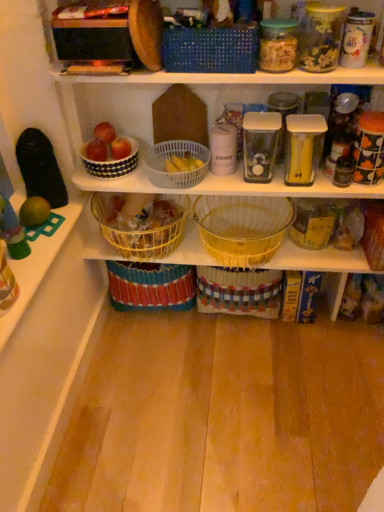
Describe the element at coordinates (374, 234) in the screenshot. The width and height of the screenshot is (384, 512). I see `woven straw basket at lower right, which is the 1th basket from right to left` at that location.

Measure the distance between point (193, 155) and camera.

They are 4.71 feet apart.

The image size is (384, 512). I want to click on woven yellow basket at center, which ranks as the 2th basket in right-to-left order, so click(x=242, y=227).

What do you see at coordinates (278, 45) in the screenshot? This screenshot has height=512, width=384. I see `translucent plastic jar at upper center, positioned as the 4th glass jar in right-to-left order` at bounding box center [278, 45].

This screenshot has width=384, height=512. Find the location of `blue woven basket at upper center, the third basket in the right-to-left sequence`. blue woven basket at upper center, the third basket in the right-to-left sequence is located at coordinates (210, 50).

From the picture: From the image's perspective, which is above, black glass jar at right or yellow woven basket at center, which appears as the 1th basket when viewed from the left?

black glass jar at right, from the image's perspective.

Is point (350, 166) positioned in front of point (128, 253)?

Yes, point (350, 166) is in front of point (128, 253).

Is yellow woven basket at center, which appears as the 1th basket when viewed from the left, completely or partially inside black glass jar at right?

No, yellow woven basket at center, which appears as the 1th basket when viewed from the left, is not a part of black glass jar at right.

Is black glass jar at right oriented away from yellow woven basket at center, which appears as the 1th basket when viewed from the left?

No, yellow woven basket at center, which appears as the 1th basket when viewed from the left, is not at the back of black glass jar at right.

Which is more to the left, clear plastic container at center, the third glass jar positioned from the left, or shiny red apple at upper center, positioned as the second apple in left-to-right order?

Positioned to the left is shiny red apple at upper center, positioned as the second apple in left-to-right order.

From their relative heights in the image, would you say clear plastic container at center, arranged as the third glass jar when viewed from the right, is taller or shorter than shiny red apple at upper center, positioned as the second apple in left-to-right order?

Considering their sizes, clear plastic container at center, arranged as the third glass jar when viewed from the right, has more height than shiny red apple at upper center, positioned as the second apple in left-to-right order.

Between clear plastic container at center, the third glass jar positioned from the left, and shiny red apple at upper center, marked as the 1th apple in a right-to-left arrangement, which one has larger width?

Wider between the two is clear plastic container at center, the third glass jar positioned from the left.

Between yellow wicker basket at center and yellow woven basket at center, which appears as the 1th basket when viewed from the left, which one has smaller size?

yellow wicker basket at center.

How many degrees apart are the facing directions of yellow wicker basket at center and yellow woven basket at center, which appears as the 1th basket when viewed from the left?

There is a 0.341-degree angle between the facing directions of yellow wicker basket at center and yellow woven basket at center, which appears as the 1th basket when viewed from the left.

Is yellow wicker basket at center to the left or to the right of yellow woven basket at center, which appears as the 1th basket when viewed from the left, in the image?

From the image, it's evident that yellow wicker basket at center is to the right of yellow woven basket at center, which appears as the 1th basket when viewed from the left.

Is yellow woven basket at center, acting as the fifth basket starting from the right, at the back of yellow wicker basket at center?

No, yellow wicker basket at center's orientation is not away from yellow woven basket at center, acting as the fifth basket starting from the right.

How different are the orientations of white plastic basket at center, which is the second basket in left-to-right order, and shiny red apple at upper center, positioned as the second apple in left-to-right order, in degrees?

white plastic basket at center, which is the second basket in left-to-right order, and shiny red apple at upper center, positioned as the second apple in left-to-right order, are facing 0.00829 degrees away from each other.

Is white plastic basket at center, positioned as the fourth basket in right-to-left order, located outside shiny red apple at upper center, positioned as the second apple in left-to-right order?

That's correct, white plastic basket at center, positioned as the fourth basket in right-to-left order, is outside of shiny red apple at upper center, positioned as the second apple in left-to-right order.

Does white plastic basket at center, positioned as the fourth basket in right-to-left order, appear on the right side of shiny red apple at upper center, positioned as the second apple in left-to-right order?

Yes.

From a real-world perspective, is white plastic basket at center, positioned as the fourth basket in right-to-left order, below shiny red apple at upper center, positioned as the second apple in left-to-right order?

Correct, in the physical world, white plastic basket at center, positioned as the fourth basket in right-to-left order, is lower than shiny red apple at upper center, positioned as the second apple in left-to-right order.

Between black glass jar at right and clear plastic container at center, the third glass jar positioned from the left, which one has larger size?

clear plastic container at center, the third glass jar positioned from the left.

Could you tell me if black glass jar at right is facing clear plastic container at center, the third glass jar positioned from the left?

No, black glass jar at right does not turn towards clear plastic container at center, the third glass jar positioned from the left.

Does black glass jar at right have a lesser height compared to clear plastic container at center, the third glass jar positioned from the left?

Correct, black glass jar at right is not as tall as clear plastic container at center, the third glass jar positioned from the left.

Is black glass jar at right directly adjacent to clear plastic container at center, the third glass jar positioned from the left?

No, black glass jar at right is not touching clear plastic container at center, the third glass jar positioned from the left.

Is white dotted bowl at upper left facing towards clear glass jar at upper right, the second glass jar viewed from the right?

→ No.

Is there a large distance between white dotted bowl at upper left and clear glass jar at upper right, the second glass jar viewed from the right?

Actually, white dotted bowl at upper left and clear glass jar at upper right, the second glass jar viewed from the right, are a little close together.

Considering the sizes of white dotted bowl at upper left and clear glass jar at upper right, the second glass jar viewed from the right, in the image, is white dotted bowl at upper left taller or shorter than clear glass jar at upper right, the second glass jar viewed from the right,?

white dotted bowl at upper left is shorter than clear glass jar at upper right, the second glass jar viewed from the right.

Is white dotted bowl at upper left positioned behind clear glass jar at upper right, which is the 4th glass jar in left-to-right order?

Yes, the depth of white dotted bowl at upper left is greater than that of clear glass jar at upper right, which is the 4th glass jar in left-to-right order.

From the image's perspective, which object appears higher, clear plastic container at center, the third glass jar positioned from the left, or translucent plastic jar at upper center, positioned as the 4th glass jar in right-to-left order?

translucent plastic jar at upper center, positioned as the 4th glass jar in right-to-left order, from the image's perspective.

Is clear plastic container at center, the third glass jar positioned from the left, outside of translucent plastic jar at upper center, positioned as the 4th glass jar in right-to-left order?

That's correct, clear plastic container at center, the third glass jar positioned from the left, is outside of translucent plastic jar at upper center, positioned as the 4th glass jar in right-to-left order.

Is point (279, 155) closer to camera compared to point (270, 54)?

No.

The image size is (384, 512). What are the coordinates of `bottle in front of the yellow woven basket at center, acting as the fifth basket starting from the right` in the screenshot? It's located at (344, 169).

From a real-world perspective, which glass jar is the 2nd one above the shiny red apple at upper center, marked as the 1th apple in a right-to-left arrangement? Please provide its 2D coordinates.

[(283, 114)]

From the image, which object appears to be nearer to black glass jar at right, white dotted bowl at upper left or woven yellow basket at center, which ranks as the 2th basket in right-to-left order?

The object closer to black glass jar at right is woven yellow basket at center, which ranks as the 2th basket in right-to-left order.

Estimate the real-world distances between objects in this image. Which object is further from black glass jar at right, white glossy canister at upper right, arranged as the 1th glass jar when viewed from the right, or white plastic basket at center, which is the second basket in left-to-right order?

white plastic basket at center, which is the second basket in left-to-right order, is further to black glass jar at right.

When comparing their distances from yellow wicker basket at center, does woven yellow basket at center, which ranks as the 2th basket in right-to-left order, or yellow woven basket at center, which appears as the 1th basket when viewed from the left, seem closer?

woven yellow basket at center, which ranks as the 2th basket in right-to-left order, is closer to yellow wicker basket at center.

Estimate the real-world distances between objects in this image. Which object is closer to transparent plastic container at center, the 5th glass jar from the right, yellow woven basket at center, which appears as the 1th basket when viewed from the left, or woven yellow basket at center, which ranks as the 4th basket in left-to-right order?

Based on the image, woven yellow basket at center, which ranks as the 4th basket in left-to-right order, appears to be nearer to transparent plastic container at center, the 5th glass jar from the right.

From the image, which object appears to be farther from clear plastic container at center, arranged as the third glass jar when viewed from the right, yellow wicker basket at center or translucent plastic jar at upper center, the 2th glass jar in the left-to-right sequence?

yellow wicker basket at center is further to clear plastic container at center, arranged as the third glass jar when viewed from the right.

Estimate the real-world distances between objects in this image. Which object is further from transparent plastic container at center, the first glass jar when ordered from left to right, red matte apple at upper left, positioned as the 1th apple in left-to-right order, or yellow woven basket at center, acting as the fifth basket starting from the right?

red matte apple at upper left, positioned as the 1th apple in left-to-right order, is positioned further to the anchor transparent plastic container at center, the first glass jar when ordered from left to right.

Estimate the real-world distances between objects in this image. Which object is closer to clear glass jar at upper right, the second glass jar viewed from the right, shiny red apple at upper center, marked as the 1th apple in a right-to-left arrangement, or woven yellow basket at center, which ranks as the 4th basket in left-to-right order?

woven yellow basket at center, which ranks as the 4th basket in left-to-right order, is positioned closer to the anchor clear glass jar at upper right, the second glass jar viewed from the right.

Looking at the image, which one is located closer to blue woven basket at upper center, the third basket in the right-to-left sequence, clear glass jar at upper right, which is the 4th glass jar in left-to-right order, or white plastic basket at center, positioned as the fourth basket in right-to-left order?

clear glass jar at upper right, which is the 4th glass jar in left-to-right order, lies closer to blue woven basket at upper center, the third basket in the right-to-left sequence, than the other object.

The image size is (384, 512). What are the coordinates of `shelf between blue woven basket at upper center, the third basket in the right-to-left sequence, and woven straw basket at lower right, which is the 1th basket from right to left` in the screenshot? It's located at coord(319,259).

Find the location of `basket between shiny red apple at upper center, positioned as the second apple in left-to-right order, and yellow woven basket at center, acting as the fifth basket starting from the right, in the vertical direction`. basket between shiny red apple at upper center, positioned as the second apple in left-to-right order, and yellow woven basket at center, acting as the fifth basket starting from the right, in the vertical direction is located at coordinates [177, 156].

At what (x,y) coordinates should I click in order to perform the action: click on apple between red matte apple at upper left, positioned as the 1th apple in left-to-right order, and clear glass jar at upper right, which is the 4th glass jar in left-to-right order, in the horizontal direction. Please return your answer as a coordinate pair (x, y). The height and width of the screenshot is (512, 384). Looking at the image, I should click on (120, 148).

Find the location of `basket situated between blue woven basket at upper center, marked as the 3th basket in a left-to-right arrangement, and woven straw basket at lower right, which is the 1th basket from right to left, from left to right`. basket situated between blue woven basket at upper center, marked as the 3th basket in a left-to-right arrangement, and woven straw basket at lower right, which is the 1th basket from right to left, from left to right is located at coordinates (242, 227).